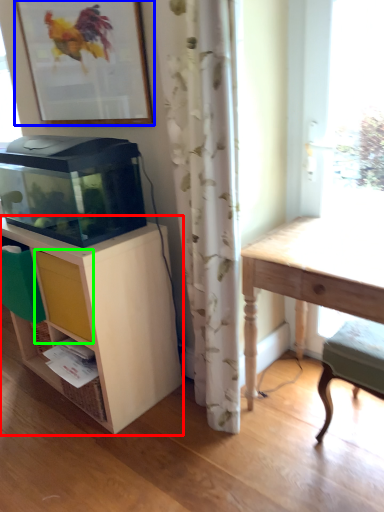
Question: Which object is the closest to the shelf (highlighted by a red box)? Choose among these: picture frame (highlighted by a blue box) or drawer (highlighted by a green box).

Choices:
 (A) picture frame
 (B) drawer

Answer: (B)